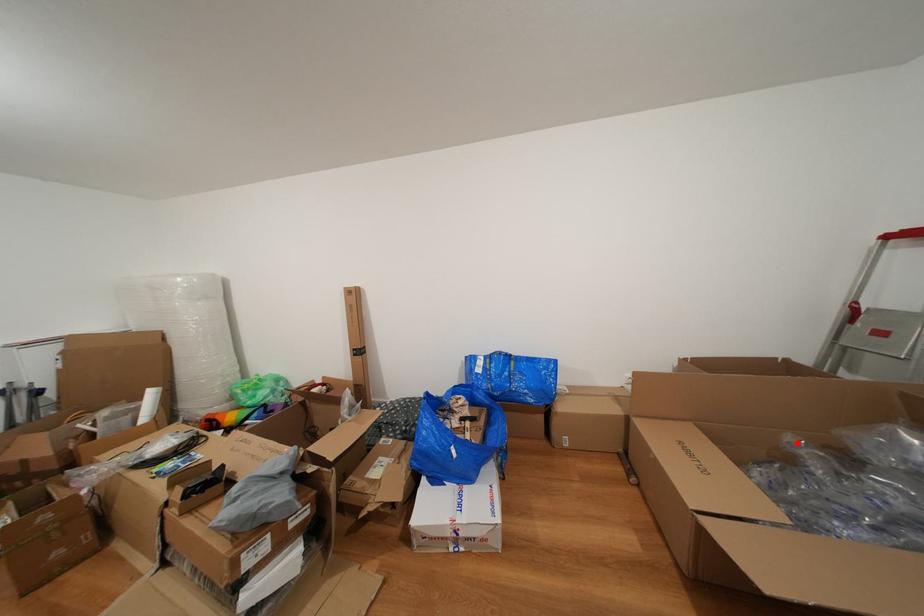
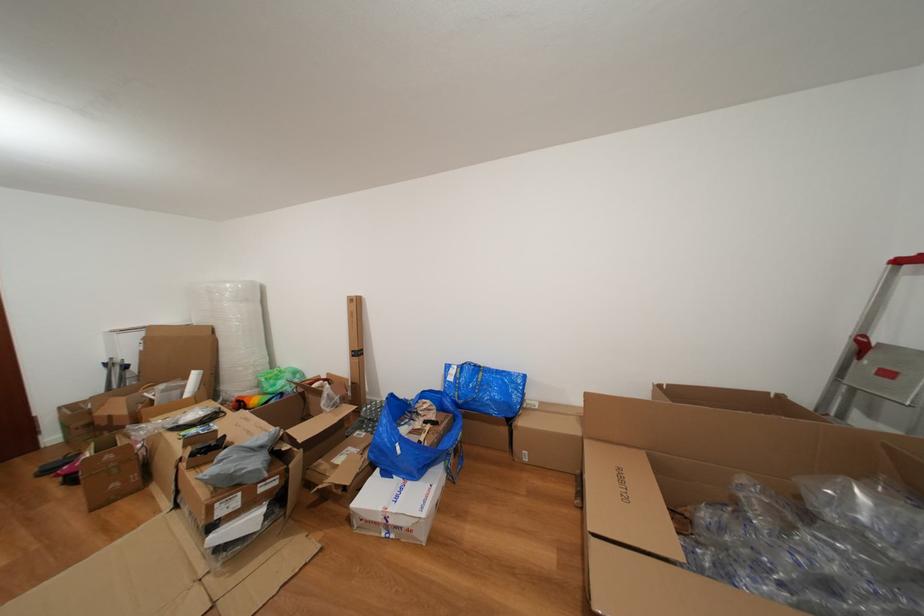
Find the pixel in the second image that matches the highlighted location in the first image.

(750, 485)